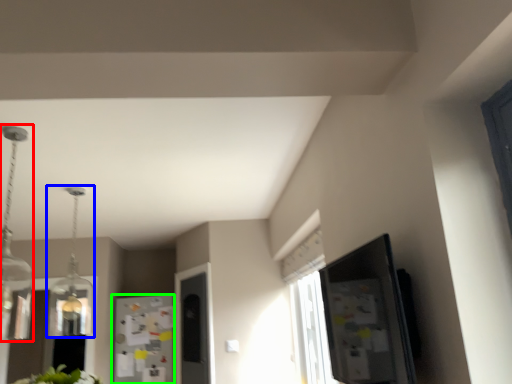
Question: Which is nearer to the light fixture (highlighted by a red box)? light fixture (highlighted by a blue box) or fridge (highlighted by a green box).

Choices:
 (A) light fixture
 (B) fridge

Answer: (A)